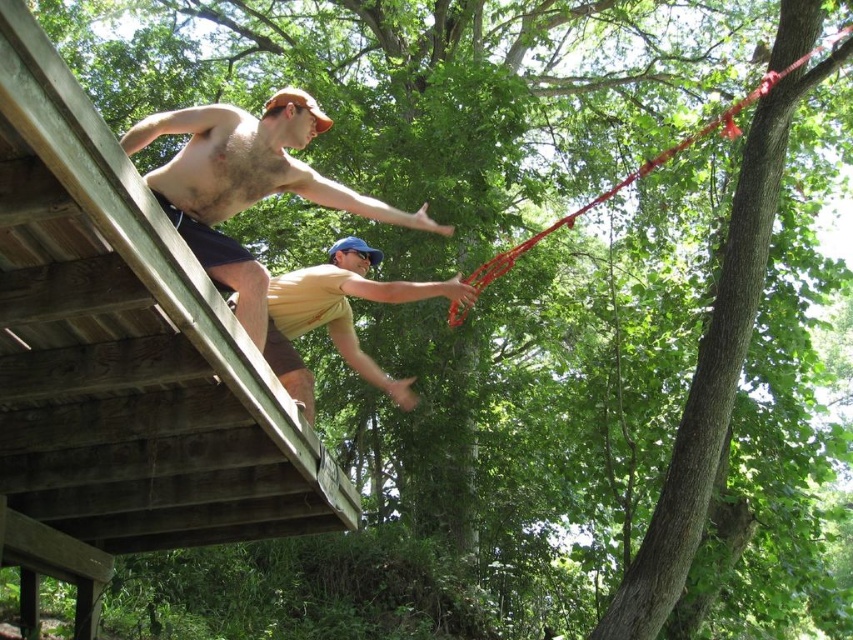
Question: Does shiny metallic pole at upper center appear on the right side of yellow matte shirt at upper center?

Choices:
 (A) no
 (B) yes

Answer: (A)

Question: Among these objects, which one is nearest to the camera?

Choices:
 (A) yellow matte shirt at upper center
 (B) shiny metallic pole at upper center
 (C) red nylon rope at upper right

Answer: (B)

Question: Among these objects, which one is farthest from the camera?

Choices:
 (A) yellow matte shirt at upper center
 (B) red nylon rope at upper right

Answer: (B)

Question: Which point is farther from the camera taking this photo?

Choices:
 (A) (494, 259)
 (B) (221, 214)
 (C) (276, 276)

Answer: (C)

Question: Observing the image, what is the correct spatial positioning of shiny metallic pole at upper center in reference to red nylon rope at upper right?

Choices:
 (A) above
 (B) below

Answer: (B)

Question: Does yellow matte shirt at upper center appear under red nylon rope at upper right?

Choices:
 (A) no
 (B) yes

Answer: (B)